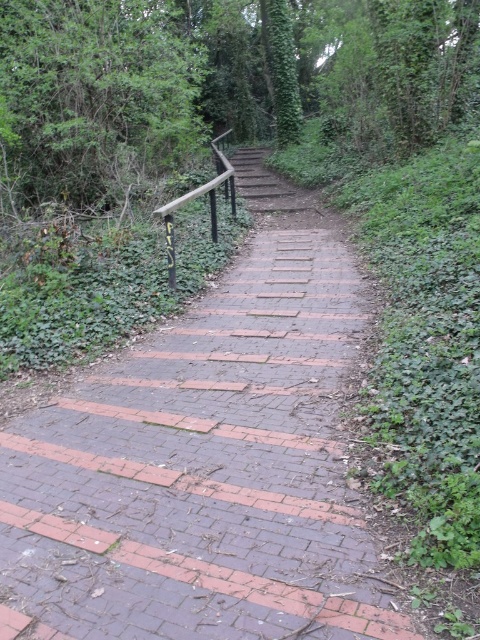
You are standing at the bottom of the staircase and want to place a small potted plant exactly where the brick at center is located. Using coordinates, where should you place the potted plant?

The brick at center is located at coordinates point (202, 472), so you should place the potted plant there.

You are standing at the bottom of the staircase and want to place a small decorative item exactly at the center of the brick at center. According to the coordinates provided, where should you place it?

The brick at center is located at the 2D coordinates point (202, 472), so you should place the small decorative item at that exact point.

You are standing at the bottom of the staircase and want to reach the green leafy tree at upper left. Which direction should you move in relation to the staircase?

The green leafy tree at upper left is located at point 0.196 on the vertical axis, so you should move upward along the staircase to reach it.